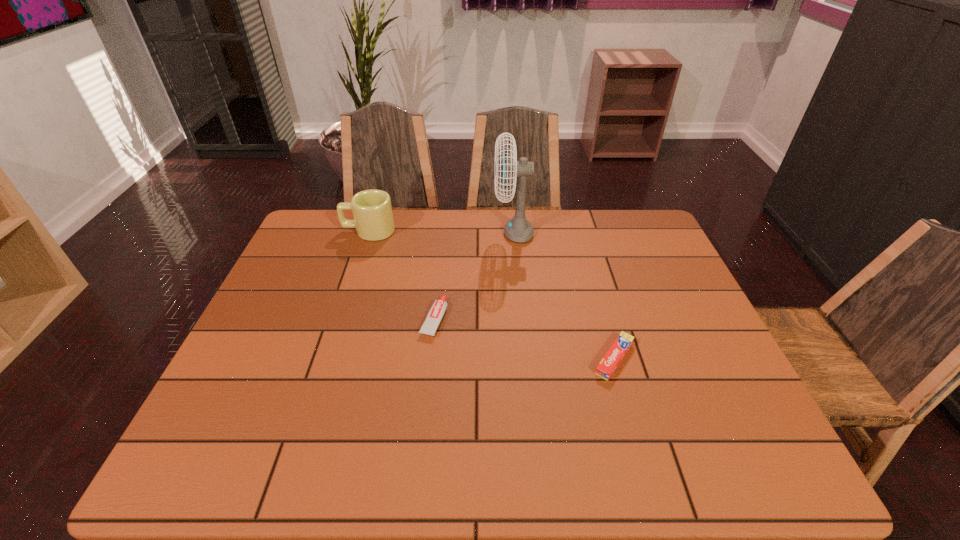
At what (x,y) coordinates should I click in order to perform the action: click on free space that satisfies the following two spatial constraints: 1. on the back side of the left toothpaste; 2. with the handle on the side of the mug. Please return your answer as a coordinate pair (x, y). Looking at the image, I should click on (444, 231).

Where is `vacant space that satisfies the following two spatial constraints: 1. with the handle on the side of the right toothpaste; 2. on the left side of the mug`? This screenshot has width=960, height=540. vacant space that satisfies the following two spatial constraints: 1. with the handle on the side of the right toothpaste; 2. on the left side of the mug is located at coordinates (326, 359).

Identify the location of free space in the image that satisfies the following two spatial constraints: 1. on the back side of the rightmost object; 2. with the handle on the side of the leftmost object. This screenshot has height=540, width=960. (578, 231).

Identify the location of vacant position in the image that satisfies the following two spatial constraints: 1. with the handle on the side of the mug; 2. on the back side of the shortest object. The width and height of the screenshot is (960, 540). (326, 359).

I want to click on vacant space that satisfies the following two spatial constraints: 1. with the handle on the side of the mug; 2. on the left side of the second object from left to right, so click(x=339, y=319).

Locate an element on the screen. vacant position in the image that satisfies the following two spatial constraints: 1. with the handle on the side of the mug; 2. on the left side of the rightmost object is located at coordinates (326, 359).

Identify the location of vacant point that satisfies the following two spatial constraints: 1. on the front-facing side of the tallest object; 2. on the back side of the rightmost object. Image resolution: width=960 pixels, height=540 pixels. (526, 359).

Where is `free space that satisfies the following two spatial constraints: 1. on the front-facing side of the tallest object; 2. on the front side of the left toothpaste`? The height and width of the screenshot is (540, 960). free space that satisfies the following two spatial constraints: 1. on the front-facing side of the tallest object; 2. on the front side of the left toothpaste is located at coordinates (522, 319).